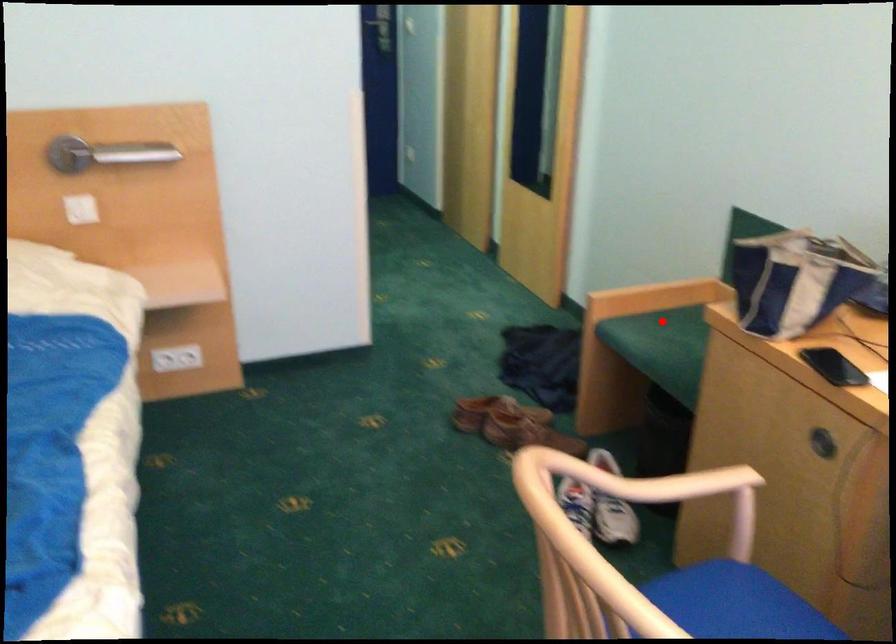
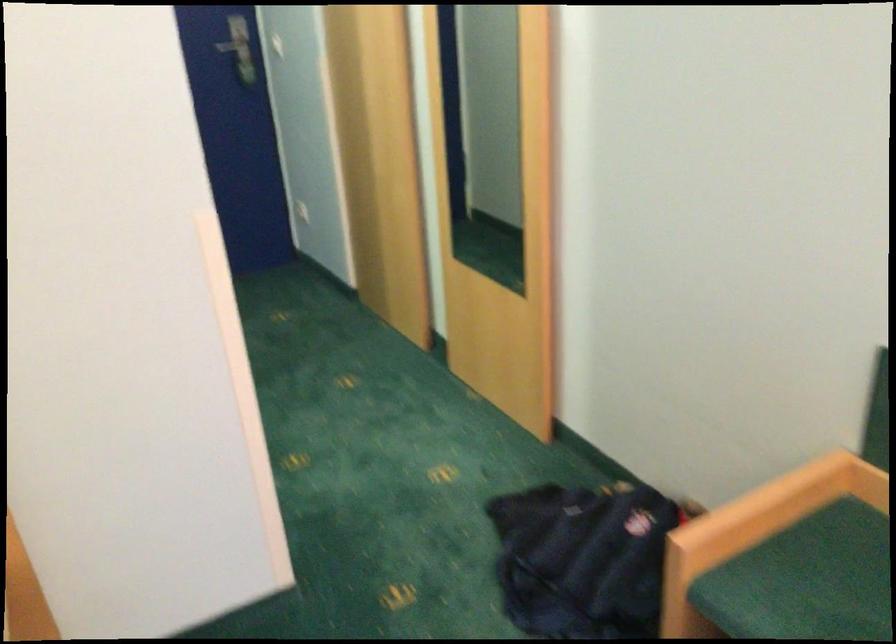
Question: I am providing you with two images of the same scene from different viewpoints. A red point is shown in image1. For the corresponding object point in image2, is it positioned nearer or farther from the camera?

Choices:
 (A) Nearer
 (B) Farther

Answer: (A)